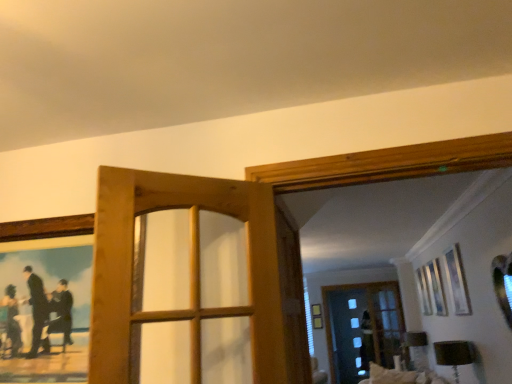
Question: Is point (32, 221) closer or farther from the camera than point (99, 316)?

Choices:
 (A) closer
 (B) farther

Answer: (B)

Question: Considering the positions of wooden picture frame at upper left and wooden door at center in the image, is wooden picture frame at upper left taller or shorter than wooden door at center?

Choices:
 (A) tall
 (B) short

Answer: (B)

Question: Estimate the real-world distances between objects in this image. Which object is closer to the wooden door at center?

Choices:
 (A) transparent glass screen door at center
 (B) wooden picture frame at upper left

Answer: (A)

Question: Considering the real-world distances, which object is closest to the wooden picture frame at upper left?

Choices:
 (A) transparent glass screen door at center
 (B) wooden door at center

Answer: (B)